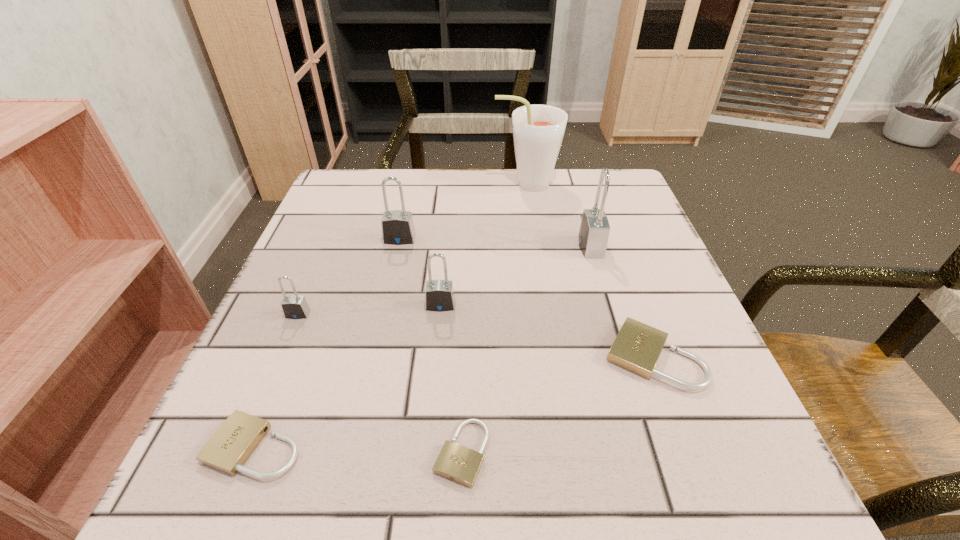
Find the location of a particular element. The height and width of the screenshot is (540, 960). vacant space at the far edge is located at coordinates point(516,175).

In the image, there is a desktop. At what (x,y) coordinates should I click in order to perform the action: click on free space at the left edge. Please return your answer as a coordinate pair (x, y). Image resolution: width=960 pixels, height=540 pixels. Looking at the image, I should click on (337, 343).

This screenshot has height=540, width=960. Find the location of `vacant space at the right edge of the desktop`. vacant space at the right edge of the desktop is located at coordinates (677, 315).

What are the coordinates of `free spot at the far left corner of the desktop` in the screenshot? It's located at (340, 182).

In the image, there is a desktop. Where is `vacant space at the near left corner`? Image resolution: width=960 pixels, height=540 pixels. vacant space at the near left corner is located at coordinates (273, 463).

Where is `vacant region at the near right corner of the desktop`? vacant region at the near right corner of the desktop is located at coordinates (668, 490).

Locate an element on the screen. The width and height of the screenshot is (960, 540). free area in between the third gray padlock from left to right and the shortest object is located at coordinates (451, 379).

Image resolution: width=960 pixels, height=540 pixels. I want to click on empty space that is in between the third tallest object and the sixth object from left to right, so click(463, 212).

Identify the location of empty space that is in between the biggest beige padlock and the smallest beige padlock. The height and width of the screenshot is (540, 960). (558, 404).

The width and height of the screenshot is (960, 540). Find the location of `free point between the biggest beige padlock and the smallest beige padlock`. free point between the biggest beige padlock and the smallest beige padlock is located at coordinates (558, 404).